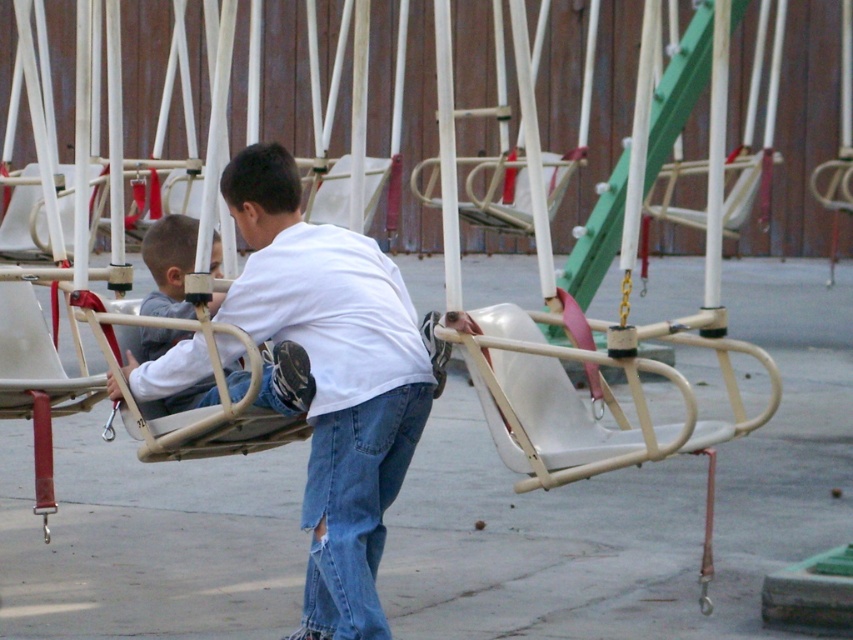
Question: Which of the following is the farthest from the observer?

Choices:
 (A) (166, 250)
 (B) (312, 566)
 (C) (387, 440)

Answer: (A)

Question: Considering the real-world distances, which object is closest to the denim at center?

Choices:
 (A) white matte shirt at center
 (B) light gray plastic swing at center

Answer: (A)

Question: Which point is closer to the camera taking this photo?

Choices:
 (A) (370, 452)
 (B) (447, 323)
 (C) (286, 396)

Answer: (C)

Question: Is denim at center to the right of light gray plastic swing at center from the viewer's perspective?

Choices:
 (A) no
 (B) yes

Answer: (B)

Question: Where is denim at center located in relation to light gray plastic swing at center in the image?

Choices:
 (A) left
 (B) right

Answer: (B)

Question: Is denim at center wider than light gray plastic swing at center?

Choices:
 (A) yes
 (B) no

Answer: (B)